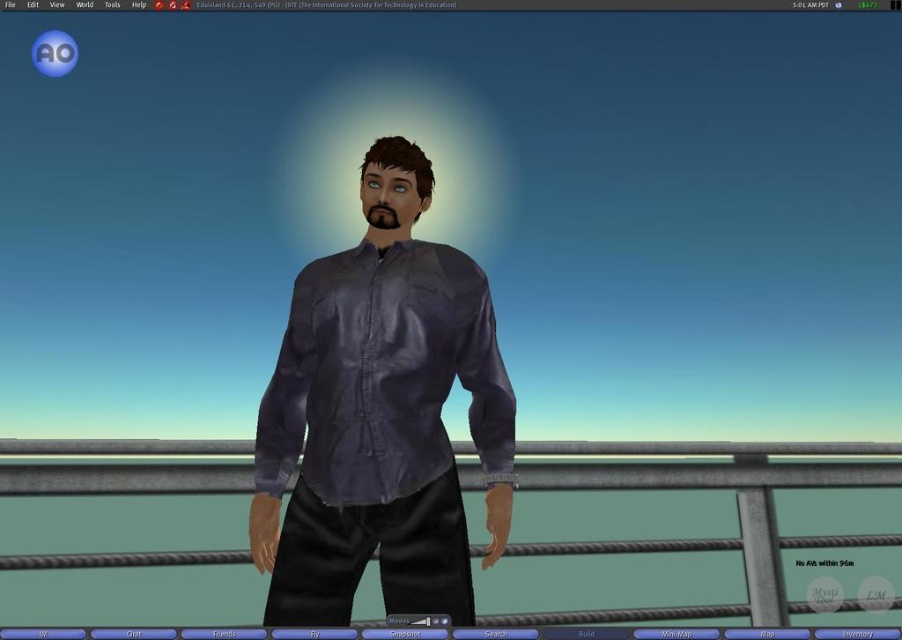
Is matte purple shirt at center to the right of ropemetallicrail at center from the viewer's perspective?

Incorrect, matte purple shirt at center is not on the right side of ropemetallicrail at center.

Is point (451, 577) closer to camera compared to point (836, 474)?

Yes, it is in front of point (836, 474).

Locate an element on the screen. The width and height of the screenshot is (902, 640). matte purple shirt at center is located at coordinates (380, 417).